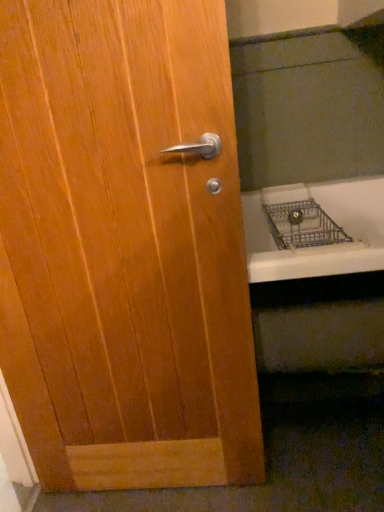
The width and height of the screenshot is (384, 512). What do you see at coordinates (320, 246) in the screenshot?
I see `metallic silver bath at lower right` at bounding box center [320, 246].

Locate an element on the screen. Image resolution: width=384 pixels, height=512 pixels. metallic silver bath at lower right is located at coordinates (320, 246).

The height and width of the screenshot is (512, 384). Find the location of `wooden door at center`. wooden door at center is located at coordinates (124, 247).

Measure the distance between point (215, 398) and camera.

3.77 feet.

This screenshot has height=512, width=384. What do you see at coordinates (124, 247) in the screenshot?
I see `wooden door at center` at bounding box center [124, 247].

This screenshot has width=384, height=512. I want to click on metallic silver bath at lower right, so click(x=320, y=246).

Between metallic silver bath at lower right and wooden door at center, which one appears on the right side from the viewer's perspective?

From the viewer's perspective, metallic silver bath at lower right appears more on the right side.

Is metallic silver bath at lower right positioned in front of wooden door at center?

No.

Considering the positions of points (262, 246) and (98, 314), is point (262, 246) closer to camera compared to point (98, 314)?

That is False.

From the image's perspective, which one is positioned higher, metallic silver bath at lower right or wooden door at center?

metallic silver bath at lower right, from the image's perspective.

From a real-world perspective, is metallic silver bath at lower right on top of wooden door at center?

No, from a real-world perspective, metallic silver bath at lower right is not on top of wooden door at center.

Which object is thinner, metallic silver bath at lower right or wooden door at center?

Thinner between the two is wooden door at center.

Considering the relative sizes of metallic silver bath at lower right and wooden door at center in the image provided, is metallic silver bath at lower right shorter than wooden door at center?

Yes.

Who is smaller, metallic silver bath at lower right or wooden door at center?

metallic silver bath at lower right.

Is metallic silver bath at lower right completely or partially outside of wooden door at center?

That's correct, metallic silver bath at lower right is outside of wooden door at center.

Would you consider metallic silver bath at lower right to be distant from wooden door at center?

metallic silver bath at lower right is near wooden door at center, not far away.

Could you tell me if metallic silver bath at lower right is facing wooden door at center?

No, metallic silver bath at lower right is not turned towards wooden door at center.

How different are the orientations of metallic silver bath at lower right and wooden door at center in degrees?

They differ by 0.491 degrees in their facing directions.

I want to click on bath that is above the wooden door at center (from the image's perspective), so click(320, 246).

Is wooden door at center at the left side of metallic silver bath at lower right?

Indeed, wooden door at center is positioned on the left side of metallic silver bath at lower right.

Considering the relative positions of wooden door at center and metallic silver bath at lower right in the image provided, is wooden door at center in front of metallic silver bath at lower right?

Yes, wooden door at center is closer to the viewer.

Is point (226, 333) closer or farther from the camera than point (253, 245)?

Point (226, 333).

From the image's perspective, relative to metallic silver bath at lower right, is wooden door at center above or below?

Clearly, from the image's perspective, wooden door at center is below metallic silver bath at lower right.

From a real-world perspective, is wooden door at center located beneath metallic silver bath at lower right?

No, from a real-world perspective, wooden door at center is not under metallic silver bath at lower right.

Is wooden door at center thinner than metallic silver bath at lower right?

Correct, the width of wooden door at center is less than that of metallic silver bath at lower right.

Is wooden door at center taller or shorter than metallic silver bath at lower right?

In the image, wooden door at center appears to be taller than metallic silver bath at lower right.

Based on their sizes in the image, would you say wooden door at center is bigger or smaller than metallic silver bath at lower right?

Considering their sizes, wooden door at center takes up more space than metallic silver bath at lower right.

Would you say wooden door at center contains metallic silver bath at lower right?

No, metallic silver bath at lower right is not inside wooden door at center.

Is wooden door at center placed right next to metallic silver bath at lower right?

They are not placed beside each other.

Does wooden door at center turn towards metallic silver bath at lower right?

No.

How many degrees apart are the facing directions of wooden door at center and metallic silver bath at lower right?

There is a 0.491-degree angle between the facing directions of wooden door at center and metallic silver bath at lower right.

The width and height of the screenshot is (384, 512). Find the location of `bath that is under the wooden door at center (from a real-world perspective)`. bath that is under the wooden door at center (from a real-world perspective) is located at coordinates (320, 246).

I want to click on door below the metallic silver bath at lower right (from the image's perspective), so click(124, 247).

The image size is (384, 512). In the image, there is a wooden door at center. What are the coordinates of `bath below it (from a real-world perspective)` in the screenshot? It's located at coord(320,246).